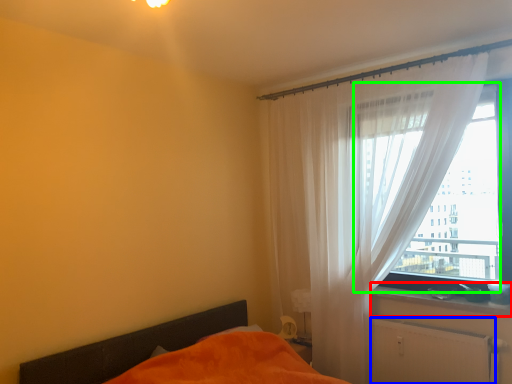
Question: Based on their relative distances, which object is farther from window sill (highlighted by a red box)? Choose from radiator (highlighted by a blue box) and window (highlighted by a green box).

Choices:
 (A) radiator
 (B) window

Answer: (B)